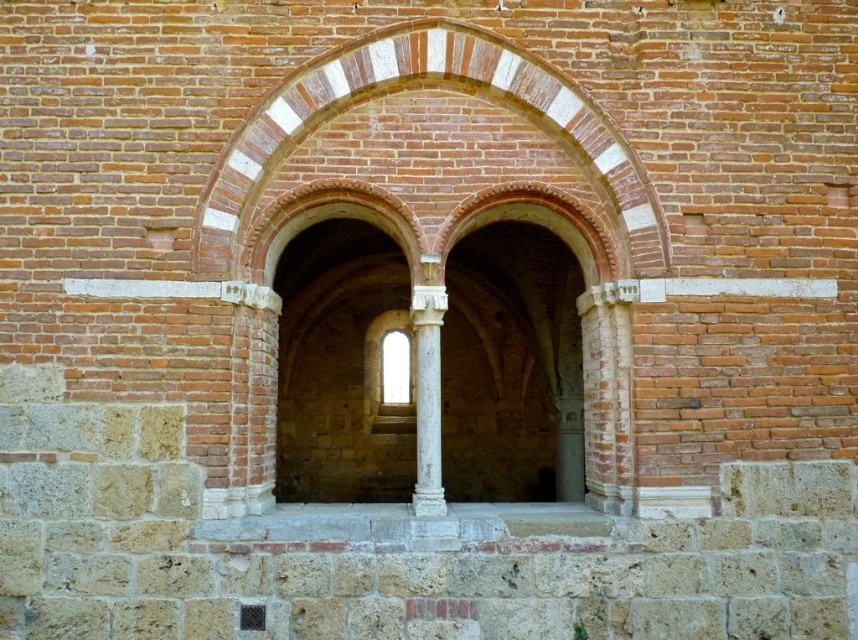
Does brick archway at center appear on the right side of clear glass window at center?

Yes, brick archway at center is to the right of clear glass window at center.

Is brick archway at center to the left of clear glass window at center from the viewer's perspective?

No, brick archway at center is not to the left of clear glass window at center.

In order to click on brick archway at center in this screenshot , I will do `click(396, 193)`.

Find the location of a particular element. This screenshot has width=858, height=640. brick archway at center is located at coordinates (396, 193).

Is brick archway at center closer to the viewer compared to white marble column at center?

Yes, brick archway at center is in front of white marble column at center.

Is brick archway at center shorter than white marble column at center?

Indeed, brick archway at center has a lesser height compared to white marble column at center.

Identify the location of brick archway at center. Image resolution: width=858 pixels, height=640 pixels. (396, 193).

Between white marble column at center and clear glass window at center, which one appears on the left side from the viewer's perspective?

clear glass window at center is more to the left.

Can you confirm if white marble column at center is bigger than clear glass window at center?

Correct, white marble column at center is larger in size than clear glass window at center.

Is point (424, 368) positioned in front of point (408, 346)?

Yes, it is in front of point (408, 346).

This screenshot has height=640, width=858. What are the coordinates of `white marble column at center` in the screenshot? It's located at (427, 397).